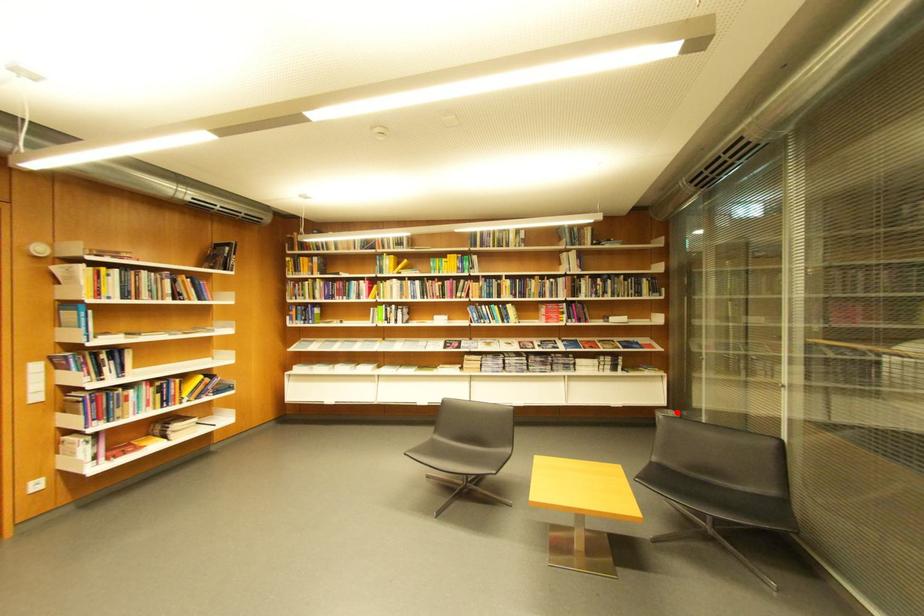
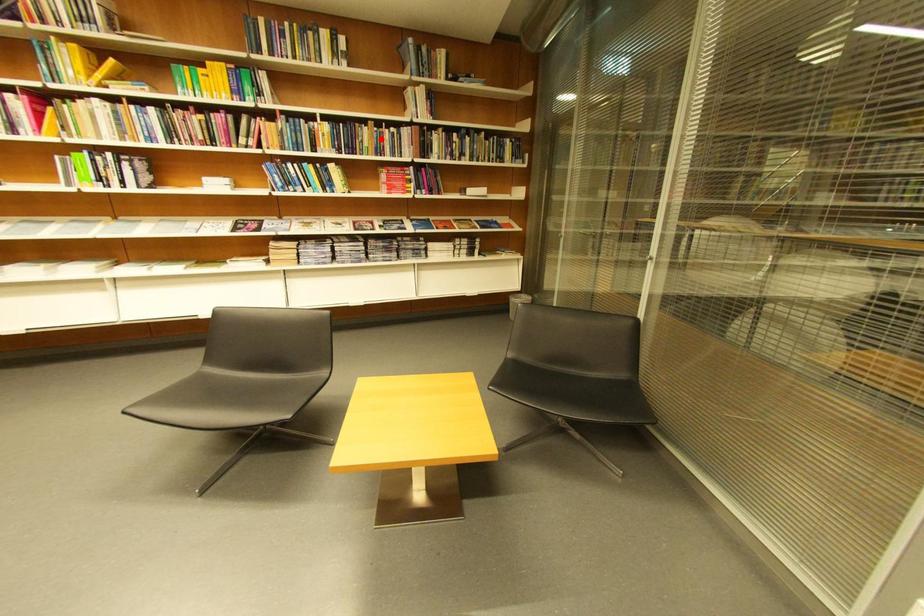
I am providing you with two images of the same scene from different viewpoints. A red point is marked on the first image and another point is marked on the second image. Is the marked point in image1 the same physical position as the marked point in image2?

No